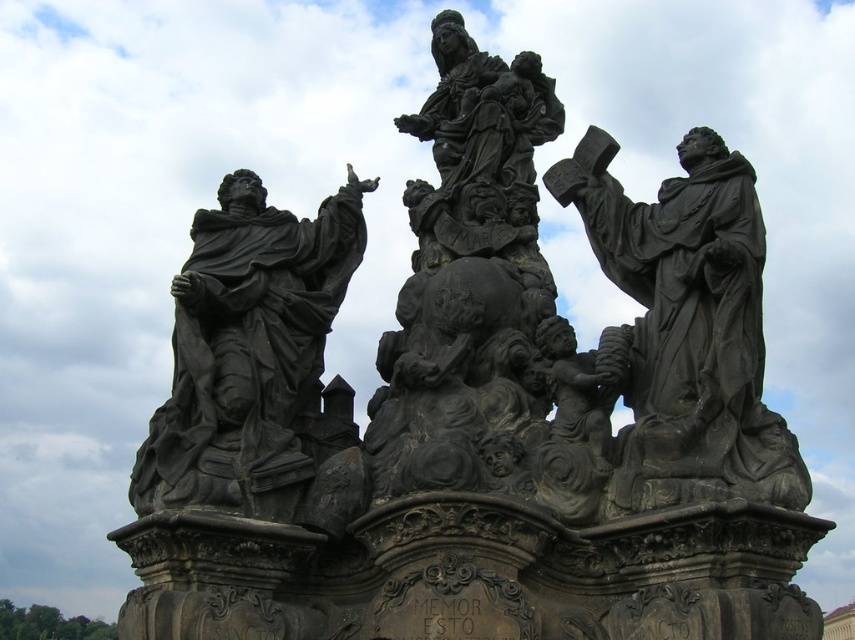
Does point (768, 442) come farther from viewer compared to point (317, 401)?

No, (768, 442) is in front of (317, 401).

Does matte black statue at right have a greater width compared to matte black statue at left?

Incorrect, matte black statue at right's width does not surpass matte black statue at left's.

Find the location of a particular element. This screenshot has width=855, height=640. matte black statue at right is located at coordinates (685, 328).